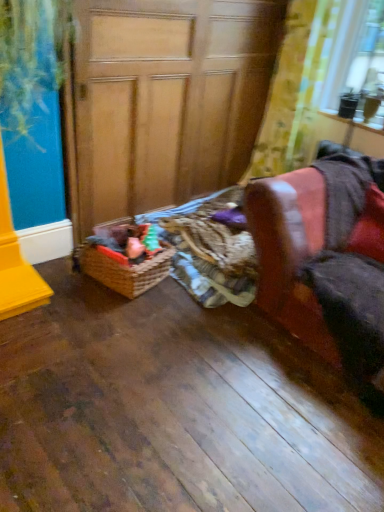
Question: Can we say yellow floral fabric at upper right lies outside wooden at left?

Choices:
 (A) yes
 (B) no

Answer: (A)

Question: Is wooden at left inside yellow floral fabric at upper right?

Choices:
 (A) no
 (B) yes

Answer: (A)

Question: Can you confirm if yellow floral fabric at upper right is wider than wooden at left?

Choices:
 (A) yes
 (B) no

Answer: (B)

Question: Is yellow floral fabric at upper right further to camera compared to wooden at left?

Choices:
 (A) no
 (B) yes

Answer: (B)

Question: Can you confirm if yellow floral fabric at upper right is taller than wooden at left?

Choices:
 (A) no
 (B) yes

Answer: (A)

Question: Is yellow floral fabric at upper right to the left of wooden at left from the viewer's perspective?

Choices:
 (A) yes
 (B) no

Answer: (B)

Question: Is there a large distance between leather armchair at right and wooden at left?

Choices:
 (A) no
 (B) yes

Answer: (B)

Question: Is leather armchair at right further to the viewer compared to wooden at left?

Choices:
 (A) no
 (B) yes

Answer: (A)

Question: Considering the relative positions of leather armchair at right and wooden at left in the image provided, is leather armchair at right to the right of wooden at left from the viewer's perspective?

Choices:
 (A) no
 (B) yes

Answer: (B)

Question: From a real-world perspective, is leather armchair at right on top of wooden at left?

Choices:
 (A) no
 (B) yes

Answer: (A)

Question: Is wooden at left at the back of leather armchair at right?

Choices:
 (A) yes
 (B) no

Answer: (B)

Question: Is leather armchair at right completely or partially outside of wooden at left?

Choices:
 (A) yes
 (B) no

Answer: (A)

Question: Could you tell me if yellow floral fabric at upper right is facing woven brown basket at lower center?

Choices:
 (A) no
 (B) yes

Answer: (B)